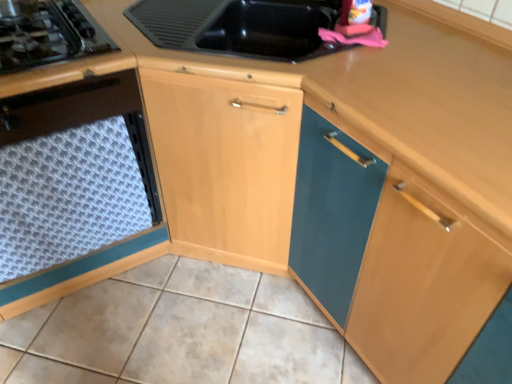
Question: Is white textured tile at lower center to the left or to the right of white textured mat at lower left in the image?

Choices:
 (A) right
 (B) left

Answer: (A)

Question: From the image's perspective, relative to white textured mat at lower left, is white textured tile at lower center above or below?

Choices:
 (A) below
 (B) above

Answer: (A)

Question: Estimate the real-world distances between objects in this image. Which object is closer to the white textured tile at lower center?

Choices:
 (A) wooden at upper right
 (B) black glass gas stove at left
 (C) white textured mat at lower left

Answer: (C)

Question: Considering the real-world distances, which object is farthest from the white textured mat at lower left?

Choices:
 (A) wooden at upper right
 (B) black glass gas stove at left
 (C) white textured tile at lower center

Answer: (A)